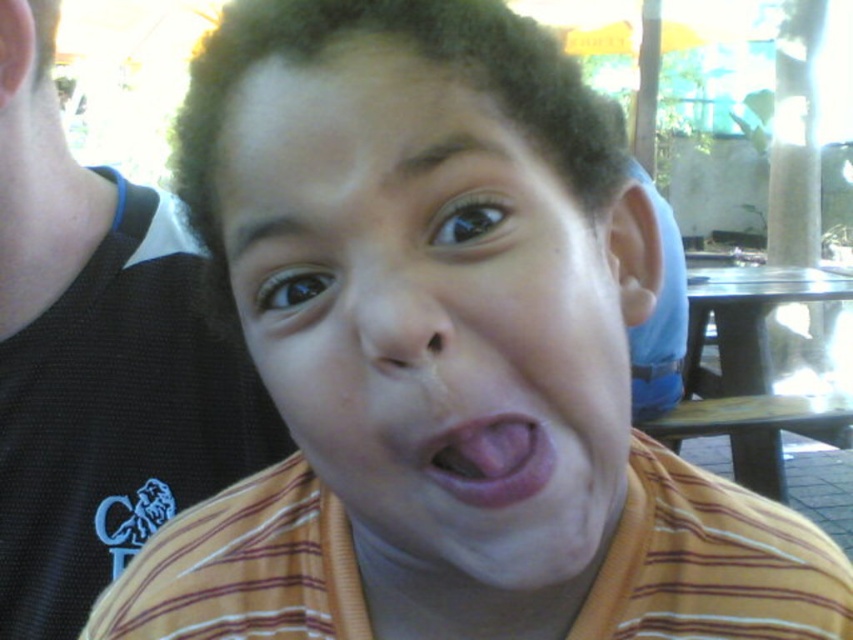
Question: In this image, where is yellow striped shirt at center located relative to pink flesh at center?

Choices:
 (A) below
 (B) above

Answer: (B)

Question: Considering the relative positions of yellow striped shirt at center and black mesh tank top at left in the image provided, where is yellow striped shirt at center located with respect to black mesh tank top at left?

Choices:
 (A) below
 (B) above

Answer: (A)

Question: Among these objects, which one is nearest to the camera?

Choices:
 (A) black mesh tank top at left
 (B) yellow striped shirt at center

Answer: (B)

Question: Which point is farther to the camera?

Choices:
 (A) yellow striped shirt at center
 (B) black mesh tank top at left
 (C) pink flesh at center

Answer: (B)

Question: Does yellow striped shirt at center appear under pink flesh at center?

Choices:
 (A) no
 (B) yes

Answer: (A)

Question: Based on their relative distances, which object is farther from the yellow striped shirt at center?

Choices:
 (A) black mesh tank top at left
 (B) pink flesh at center

Answer: (A)